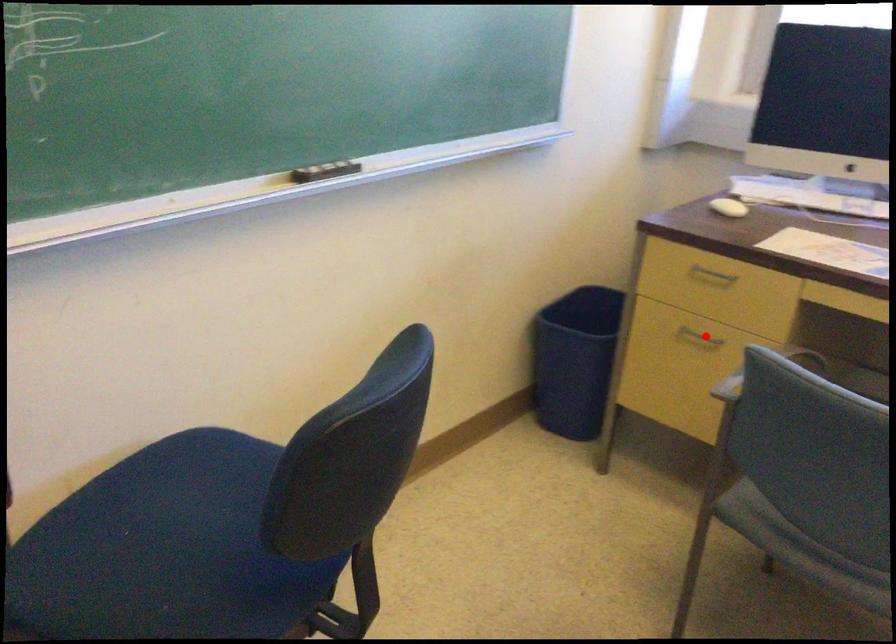
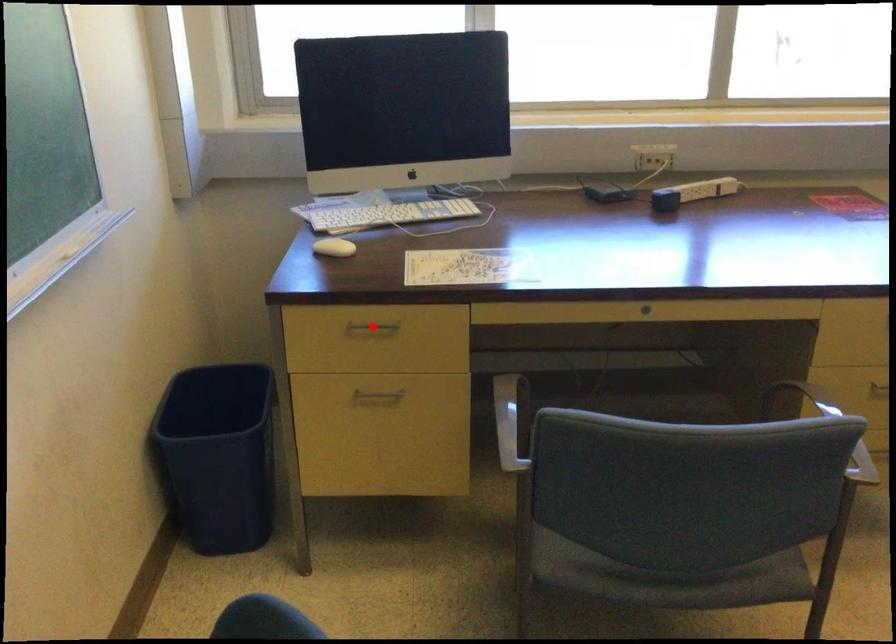
I am providing you with two images of the same scene from different viewpoints. A red point is marked on the first image and another point is marked on the second image. Does the point marked in image1 correspond to the same location as the one in image2?

No